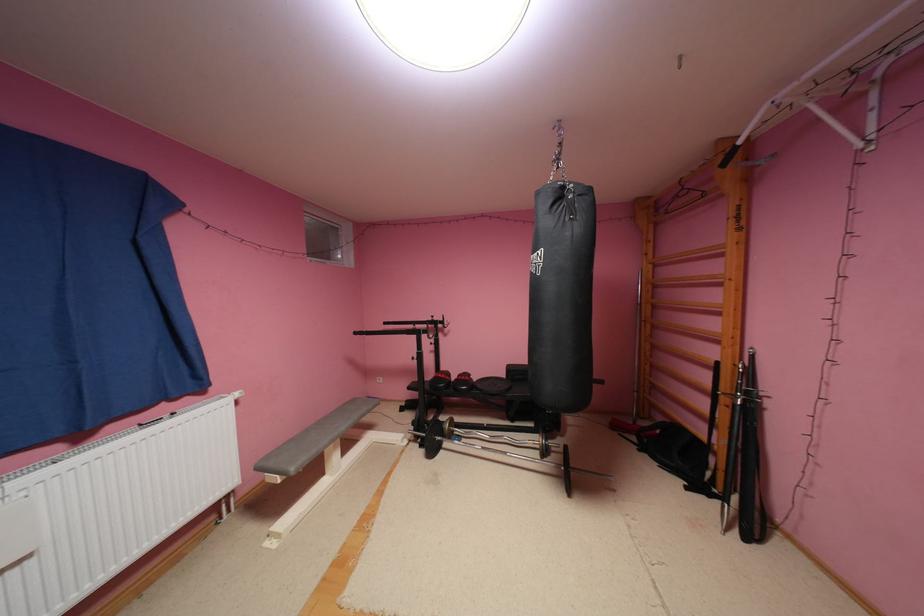
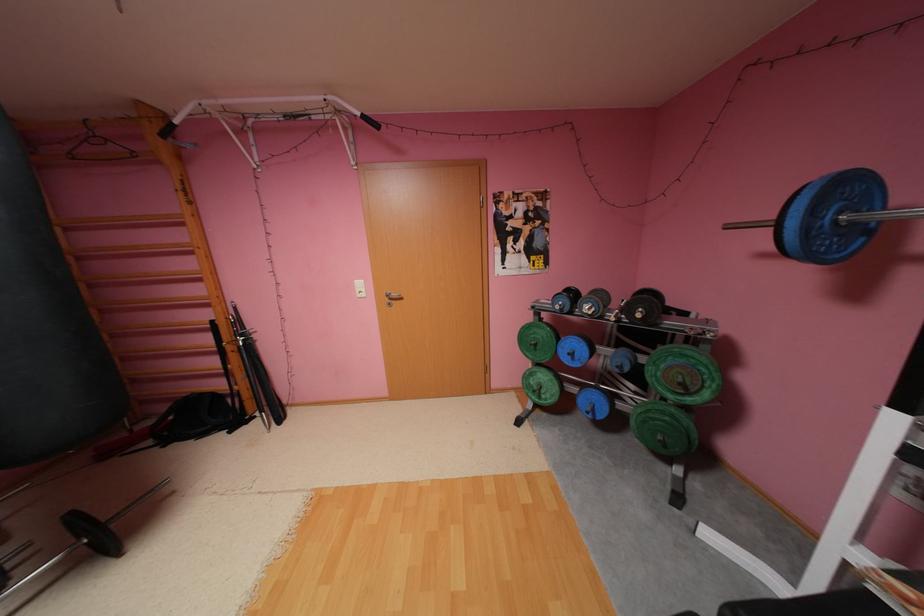
Find the pixel in the second image that matches (x=722, y=276) in the first image.

(187, 245)